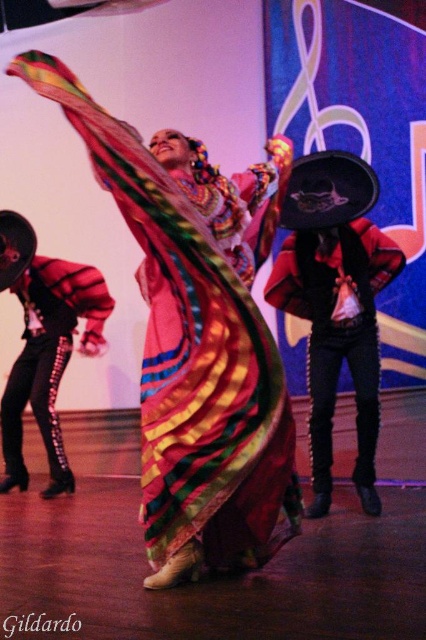
Does velvet black sombrero at center have a lesser height compared to brushed metal sombrero at left?

Yes, velvet black sombrero at center is shorter than brushed metal sombrero at left.

Is point (310, 241) positioned before point (16, 396)?

That is True.

Locate an element on the screen. This screenshot has height=640, width=426. velvet black sombrero at center is located at coordinates (337, 330).

Locate an element on the screen. velvet black sombrero at center is located at coordinates (337, 330).

Is silky multicolored skirt at center behind brushed metal sombrero at left?

No, silky multicolored skirt at center is in front of brushed metal sombrero at left.

Can you confirm if silky multicolored skirt at center is wider than brushed metal sombrero at left?

Indeed, silky multicolored skirt at center has a greater width compared to brushed metal sombrero at left.

Does point (83, 104) lie in front of point (40, 369)?

Yes, it is.

The image size is (426, 640). In order to click on silky multicolored skirt at center in this screenshot , I will do `click(196, 339)`.

Does silky multicolored skirt at center come in front of velvet black sombrero at center?

Yes.

Is point (166, 166) less distant than point (370, 340)?

Yes, it is in front of point (370, 340).

Who is more forward, [181,355] or [322,468]?

Point [181,355]

What are the coordinates of `silky multicolored skirt at center` in the screenshot? It's located at (196, 339).